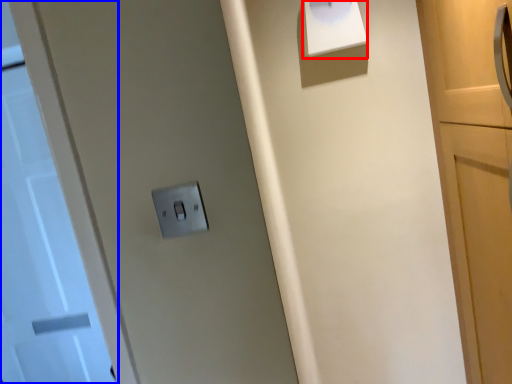
Question: Which object appears closest to the camera in this image, wide (highlighted by a red box) or door (highlighted by a blue box)?

Choices:
 (A) wide
 (B) door

Answer: (A)